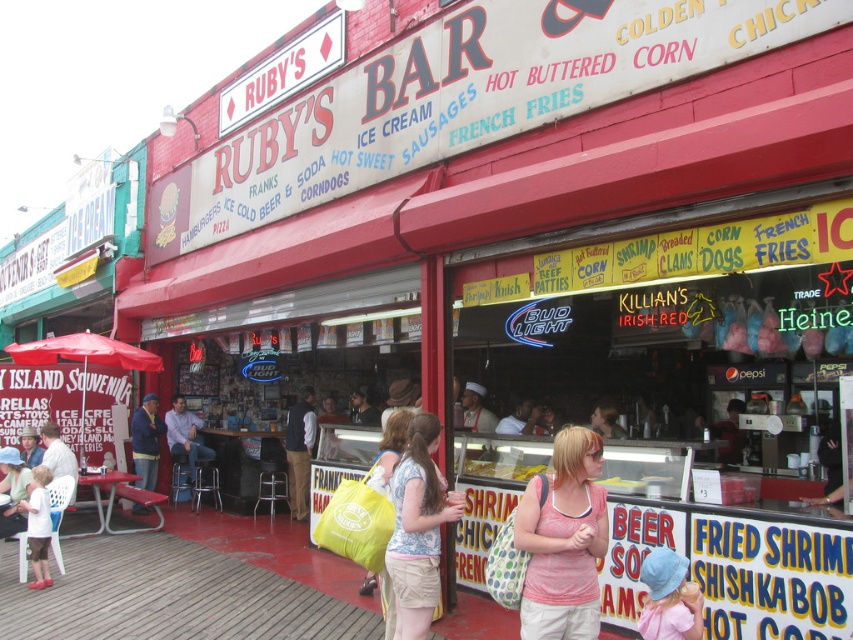
You are a customer at Ruby Bar and you want to order a drink. You see a staff member wearing dark blue jeans at center and another staff member wearing blue denim jacket at lower left. Which staff member is taller?

The dark blue jeans at center is taller than blue denim jacket at lower left, so the staff member wearing dark blue jeans at center is taller.

You are a customer at Ruby Bar and you see the light blue denim shorts at center and the golden fried shrimp at center. Which item is closer to you?

The light blue denim shorts at center is positioned under the golden fried shrimp at center, so the golden fried shrimp at center is closer to you.